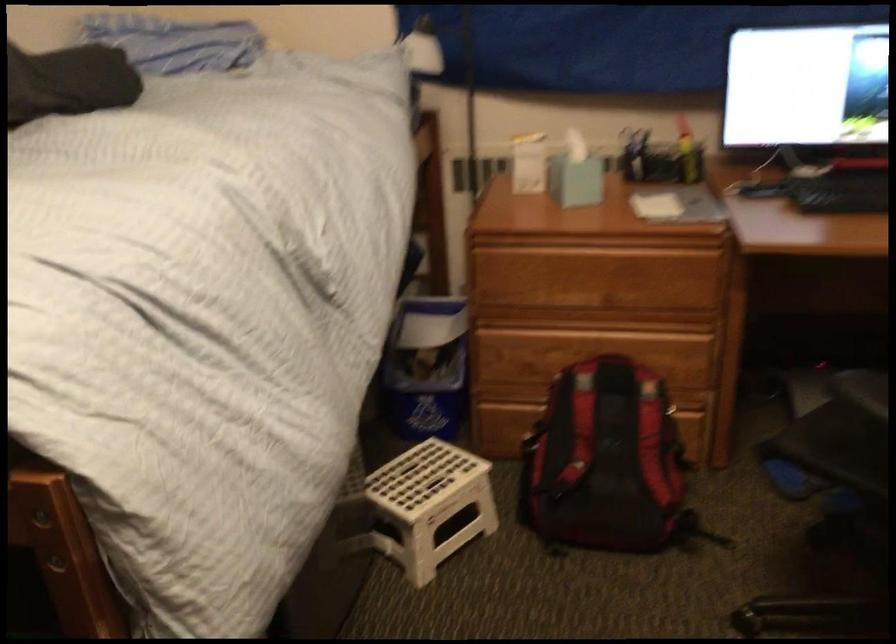
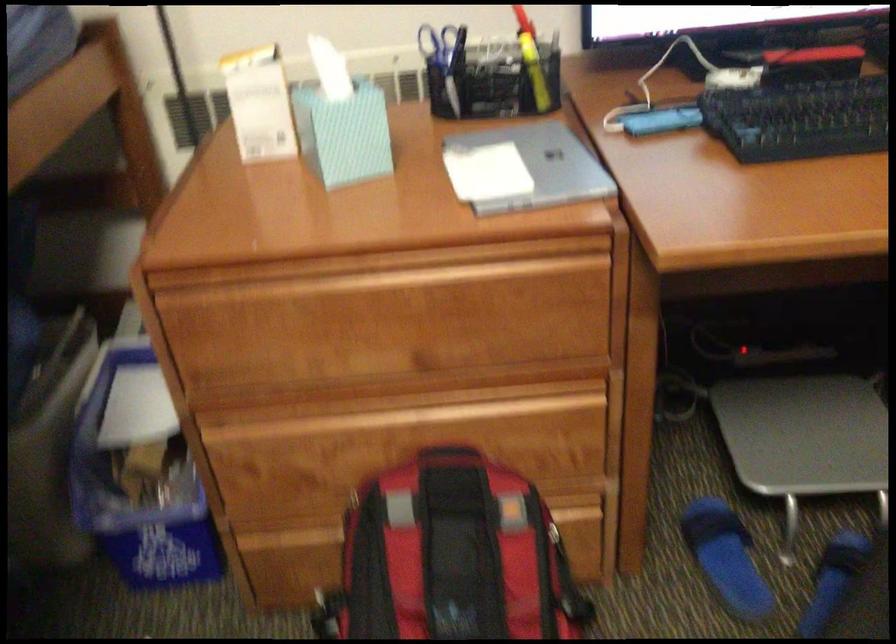
Question: The images are taken continuously from a first-person perspective. In which direction are you moving?

Choices:
 (A) Left
 (B) Right
 (C) Forward
 (D) Backward

Answer: (C)